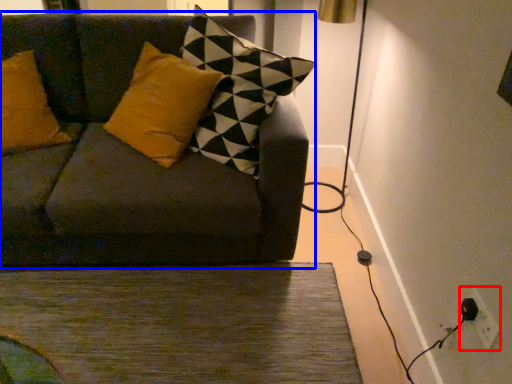
Question: Which point is closer to the camera, electric outlet (highlighted by a red box) or studio couch (highlighted by a blue box)?

Choices:
 (A) electric outlet
 (B) studio couch

Answer: (A)